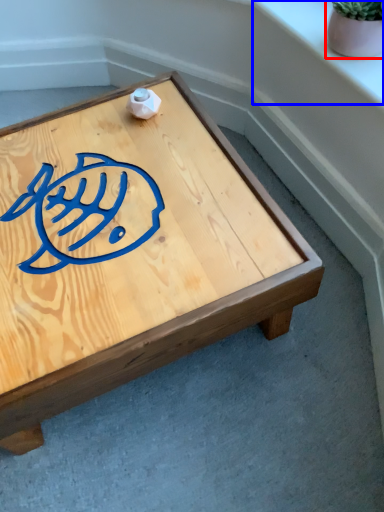
Question: Which point is closer to the camera, flowerpot (highlighted by a red box) or window sill (highlighted by a blue box)?

Choices:
 (A) flowerpot
 (B) window sill

Answer: (A)